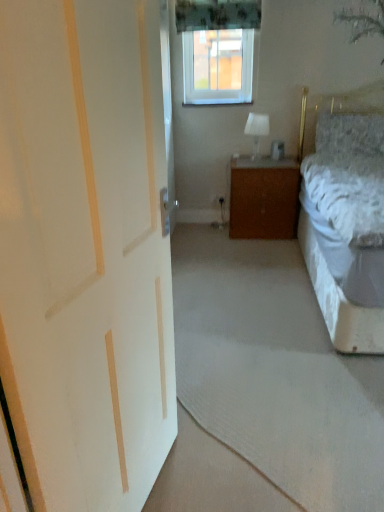
Find the location of a particular element. free space to the left of wooden cabinet at center is located at coordinates (203, 233).